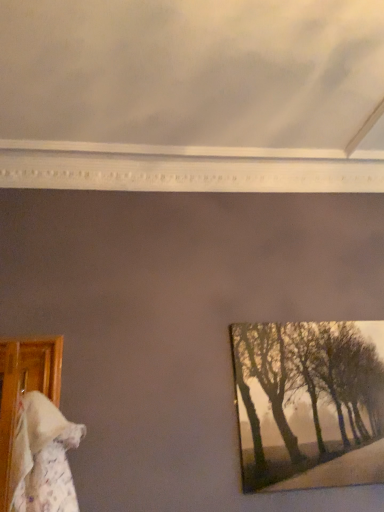
The image size is (384, 512). What do you see at coordinates (309, 403) in the screenshot?
I see `silvery metallic picture frame at right` at bounding box center [309, 403].

Where is `silvery metallic picture frame at right`? The height and width of the screenshot is (512, 384). silvery metallic picture frame at right is located at coordinates (309, 403).

I want to click on silvery metallic picture frame at right, so click(x=309, y=403).